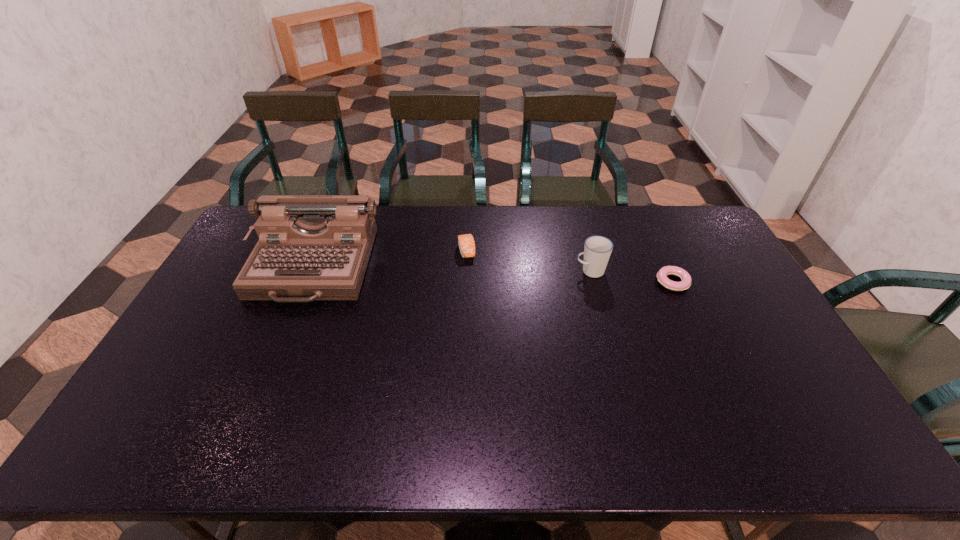
Locate an element on the screen. The image size is (960, 540). vacant area at the left edge of the desktop is located at coordinates (207, 292).

Where is `vacant region at the far left corner of the desktop`? vacant region at the far left corner of the desktop is located at coordinates (250, 236).

Find the location of a particular element. vacant space at the near left corner of the desktop is located at coordinates pyautogui.click(x=134, y=424).

At what (x,y) coordinates should I click in order to perform the action: click on vacant point located between the rightmost object and the second object from left to right. Please return your answer as a coordinate pair (x, y). This screenshot has width=960, height=540. Looking at the image, I should click on (569, 266).

Locate an element on the screen. The width and height of the screenshot is (960, 540). vacant space in between the cup and the third object from right to left is located at coordinates (529, 261).

Where is `vacant area that lies between the shortest object and the third object from left to right`? The height and width of the screenshot is (540, 960). vacant area that lies between the shortest object and the third object from left to right is located at coordinates (632, 276).

This screenshot has height=540, width=960. In order to click on blank region between the shortest object and the sushi in this screenshot , I will do `click(569, 266)`.

You are a GUI agent. You are given a task and a screenshot of the screen. Output one action in this format:
    pyautogui.click(x=<x>, y=<y>)
    Task: Click on the free point between the second tallest object and the shortest object
    The image size is (960, 540).
    Given the screenshot: What is the action you would take?
    pyautogui.click(x=632, y=276)

You are a GUI agent. You are given a task and a screenshot of the screen. Output one action in this format:
    pyautogui.click(x=<x>, y=<y>)
    Task: Click on the free space that is in between the third shortest object and the typewriter
    
    Given the screenshot: What is the action you would take?
    pyautogui.click(x=451, y=269)

At what (x,y) coordinates should I click in order to perform the action: click on free space between the cup and the tallest object. Please return your answer as a coordinate pair (x, y). Looking at the image, I should click on (451, 269).